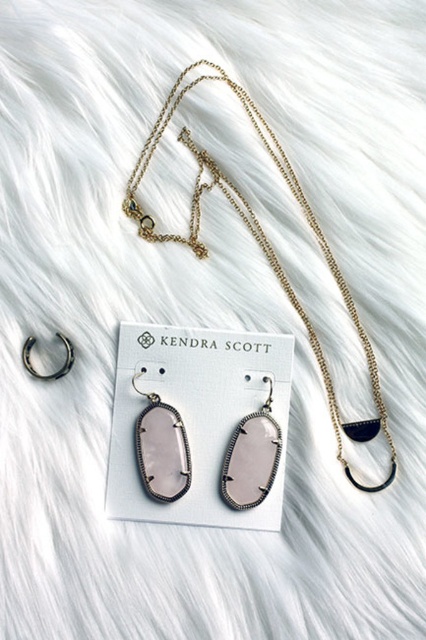
Question: Is gold chain necklace at upper center below pink glass earring at center?

Choices:
 (A) yes
 (B) no

Answer: (B)

Question: Can you confirm if gold chain necklace at upper center is bigger than pink glass earring at center?

Choices:
 (A) yes
 (B) no

Answer: (A)

Question: Which point is closer to the camera?

Choices:
 (A) pink glass earring at center
 (B) gold chain necklace at upper center

Answer: (B)

Question: Which of the following is the farthest from the observer?

Choices:
 (A) pink glass earring at center
 (B) gold chain necklace at upper center

Answer: (A)

Question: Does gold chain necklace at upper center appear over pink glass earring at center?

Choices:
 (A) yes
 (B) no

Answer: (A)

Question: Among these points, which one is nearest to the camera?

Choices:
 (A) (189, 65)
 (B) (236, 488)

Answer: (B)